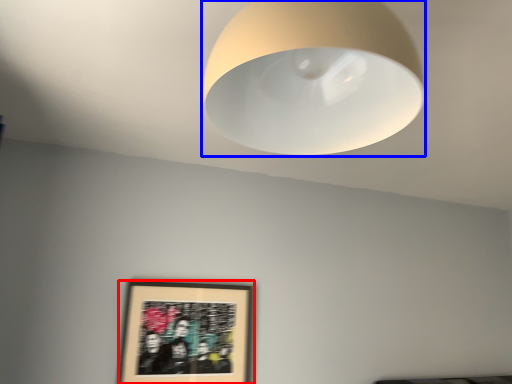
Question: Which point is closer to the camera, picture frame (highlighted by a red box) or lamp (highlighted by a blue box)?

Choices:
 (A) picture frame
 (B) lamp

Answer: (B)